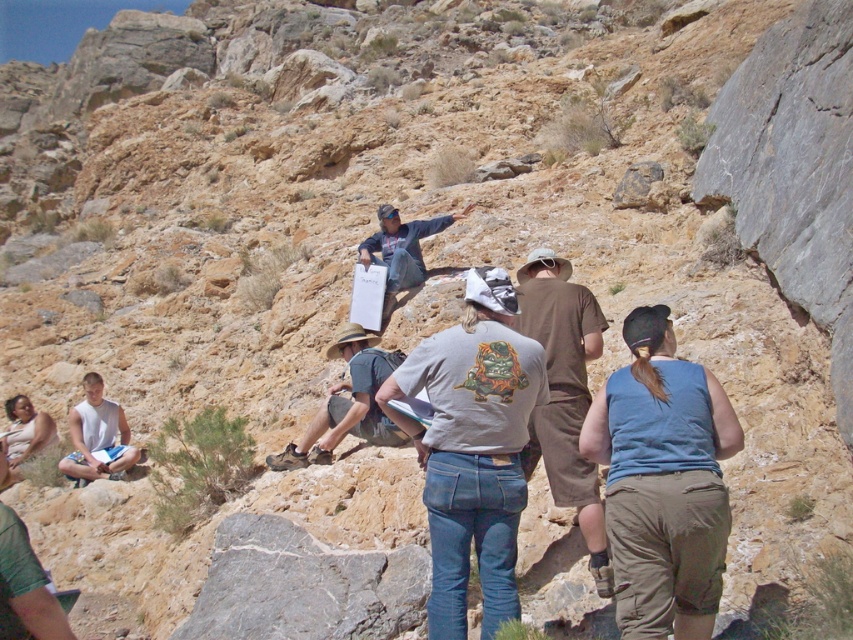
You are a photographer trying to capture a group photo of the people in the desert scene. You notice two individuals wearing the brown cotton shirt at center and the white cotton tank top at lower left. Which person should you position closer to the front to ensure both are visible in the photo?

Since the brown cotton shirt at center is much taller than the white cotton tank top at lower left, you should position the person wearing the white cotton tank top at lower left in the front row to avoid being obscured by the taller individual.

You are standing in the desert scene and want to reach the point marked at coordinates (474, 456). If you walk straight ahead, will you reach that point before walking 30 meters?

Yes, because the point is 26.24 meters away from the viewer, which is less than 30 meters.